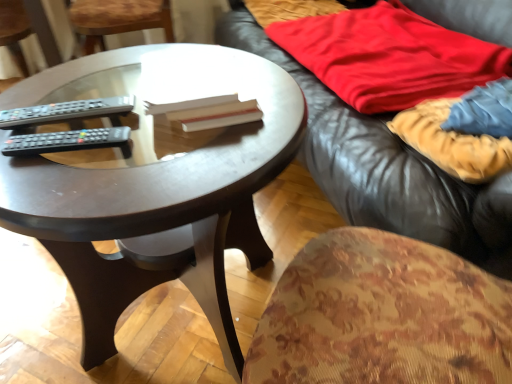
Find the location of a particular element. vacant area that lies to the right of black plastic remote control at left, positioned as the 2th remote control in back-to-front order is located at coordinates (174, 155).